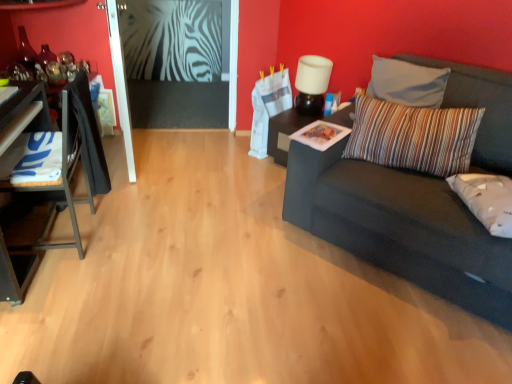
Question: Considering the positions of striped fabric pillow at right, acting as the first pillow starting from the top, and dark gray fabric couch at right in the image, is striped fabric pillow at right, acting as the first pillow starting from the top, wider or thinner than dark gray fabric couch at right?

Choices:
 (A) wide
 (B) thin

Answer: (B)

Question: Choose the correct answer: Is striped fabric pillow at right, arranged as the second pillow when ordered from the bottom, inside dark gray fabric couch at right or outside it?

Choices:
 (A) inside
 (B) outside

Answer: (A)

Question: Estimate the real-world distances between objects in this image. Which object is farther from the dark gray fabric couch at right?

Choices:
 (A) white fabric pillow at right, acting as the 2th pillow starting from the top
 (B) striped fabric pillow at right, acting as the first pillow starting from the top
 (C) white matte lamp at upper center
 (D) black glossy table at center, which is the first table from right to left
 (E) white glossy table at left, the first table from the front

Answer: (E)

Question: Estimate the real-world distances between objects in this image. Which object is closer to the black glossy table at center, which is the second table in left-to-right order?

Choices:
 (A) white glossy table at left, which is counted as the 2th table, starting from the back
 (B) striped fabric pillow at right, acting as the first pillow starting from the top
 (C) white matte lamp at upper center
 (D) white fabric pillow at right, acting as the 2th pillow starting from the top
 (E) dark gray fabric couch at right

Answer: (C)